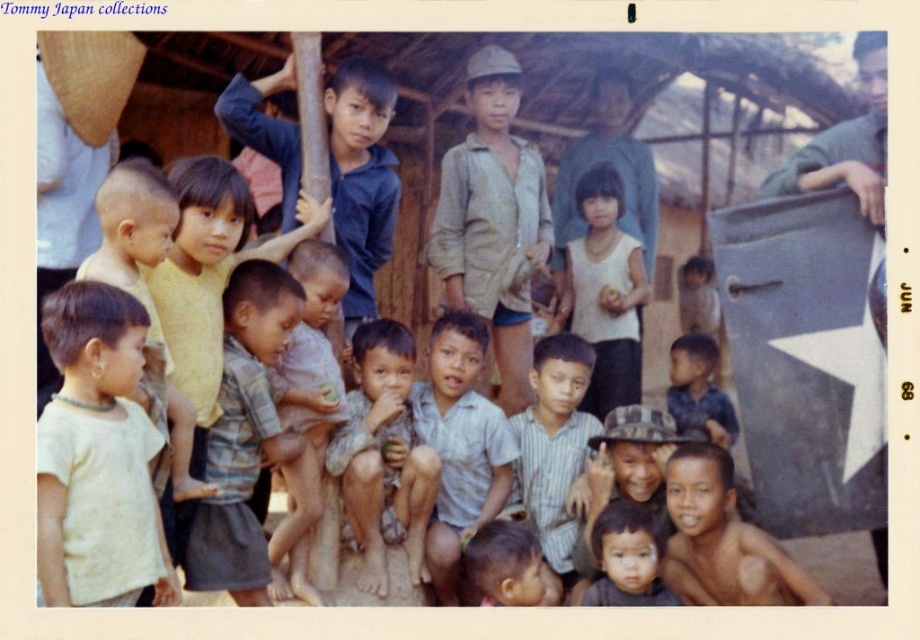
Which is more to the right, striped cotton shirt at center or smooth skin baby at lower center?

smooth skin baby at lower center is more to the right.

Can you confirm if striped cotton shirt at center is bigger than smooth skin baby at lower center?

Yes, striped cotton shirt at center is bigger than smooth skin baby at lower center.

Between point (576, 344) and point (612, 531), which one is positioned behind?

Positioned behind is point (576, 344).

I want to click on striped cotton shirt at center, so click(x=555, y=452).

Consider the image. Is camouflage-patterned shirt at center below blue striped shirt at center?

Indeed, camouflage-patterned shirt at center is positioned under blue striped shirt at center.

Is camouflage-patterned shirt at center further to camera compared to blue striped shirt at center?

No, it is not.

This screenshot has height=640, width=920. What are the coordinates of `camouflage-patterned shirt at center` in the screenshot? It's located at (243, 435).

In the scene shown: Is brown skin boy at center bigger than blue striped shirt at center?

Yes.

Can you confirm if brown skin boy at center is positioned above blue striped shirt at center?

No.

The image size is (920, 640). What do you see at coordinates (723, 541) in the screenshot?
I see `brown skin boy at center` at bounding box center [723, 541].

The width and height of the screenshot is (920, 640). I want to click on brown skin boy at center, so click(x=723, y=541).